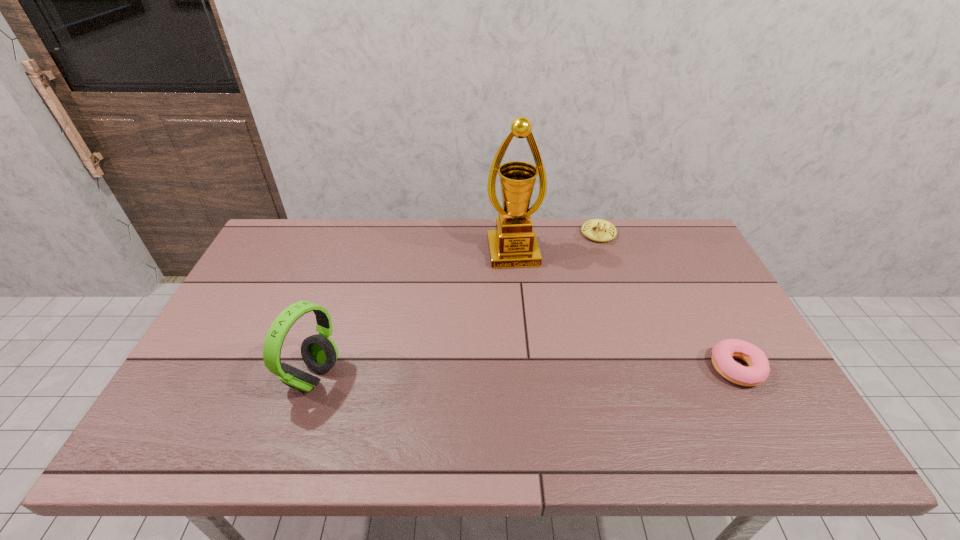
Locate an element on the screen. free spot on the desktop that is between the headset and the shortest object and is positioned on the front-facing side of the third object from right to left is located at coordinates (538, 372).

The image size is (960, 540). I want to click on free space on the desktop that is between the headset and the shortest object and is positioned on the face of the duckling, so click(581, 371).